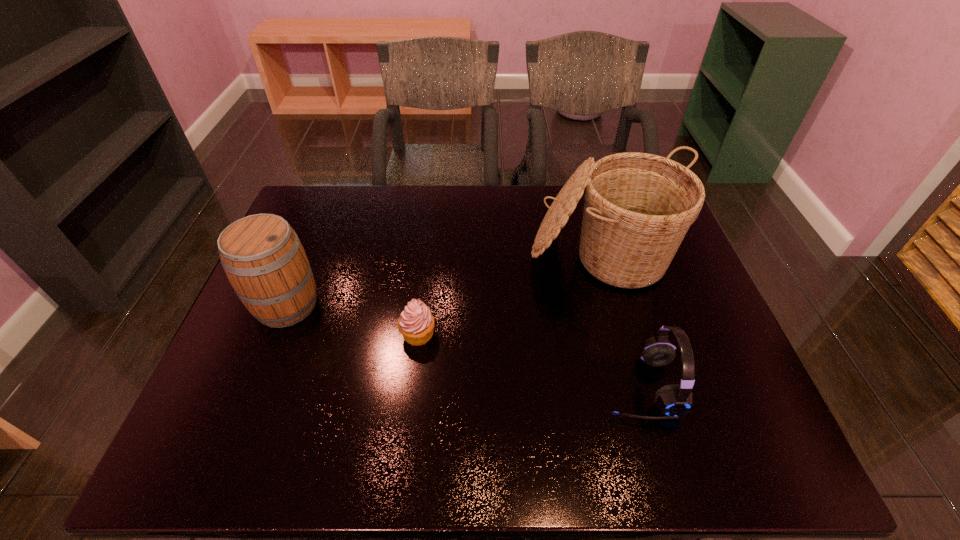
Locate an element on the screen. The width and height of the screenshot is (960, 540). the tallest object is located at coordinates coord(638,207).

What are the coordinates of `cider` in the screenshot? It's located at (262, 256).

Locate an element on the screen. the leftmost object is located at coordinates (262, 256).

Where is `the nearest object`? The height and width of the screenshot is (540, 960). the nearest object is located at coordinates (674, 400).

Locate an element on the screen. headset is located at coordinates (674, 400).

The width and height of the screenshot is (960, 540). I want to click on the second object from left to right, so click(416, 323).

The height and width of the screenshot is (540, 960). What are the coordinates of `cupcake` in the screenshot? It's located at 416,323.

Where is `vacant area situated on the left of the tallest object`? vacant area situated on the left of the tallest object is located at coordinates (502, 254).

At what (x,y) coordinates should I click in order to perform the action: click on free space located on the back of the cider. Please return your answer as a coordinate pair (x, y). Image resolution: width=960 pixels, height=540 pixels. Looking at the image, I should click on (320, 221).

This screenshot has width=960, height=540. What are the coordinates of `vacant space situated 0.200m on the ear cushions of the nearest object` in the screenshot? It's located at pyautogui.click(x=513, y=386).